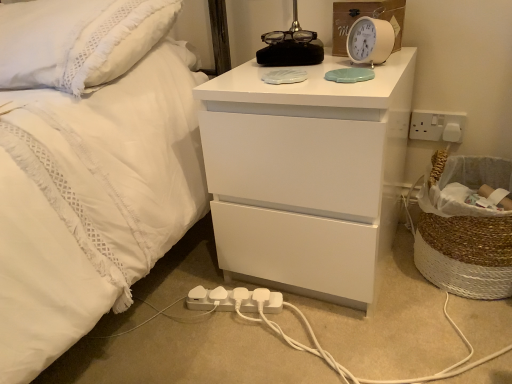
Identify the location of free region on the left part of white plastic extension cord at lower center. (160, 320).